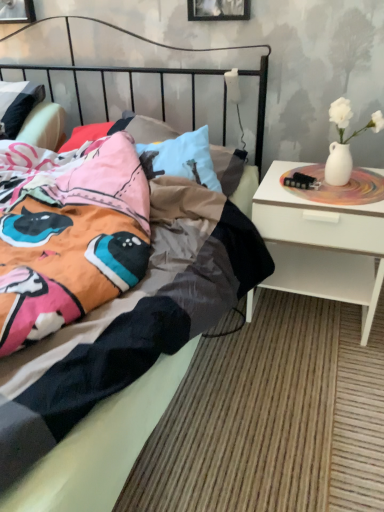
Question: Is metallic silver picture frame at upper left, arranged as the first picture frame when viewed from the left, aimed at black matte picture frame at upper center, the second picture frame from the left?

Choices:
 (A) yes
 (B) no

Answer: (B)

Question: Does metallic silver picture frame at upper left, the 1th picture frame in the back-to-front sequence, appear on the right side of black matte picture frame at upper center, which ranks as the 1th picture frame in front-to-back order?

Choices:
 (A) yes
 (B) no

Answer: (B)

Question: Is there a large distance between metallic silver picture frame at upper left, placed as the second picture frame when sorted from front to back, and black matte picture frame at upper center, arranged as the second picture frame when viewed from the back?

Choices:
 (A) no
 (B) yes

Answer: (A)

Question: From a real-world perspective, does metallic silver picture frame at upper left, placed as the second picture frame when sorted from front to back, sit lower than black matte picture frame at upper center, the second picture frame from the left?

Choices:
 (A) no
 (B) yes

Answer: (B)

Question: Considering the relative sizes of metallic silver picture frame at upper left, arranged as the first picture frame when viewed from the left, and black matte picture frame at upper center, which ranks as the 1th picture frame in front-to-back order, in the image provided, is metallic silver picture frame at upper left, arranged as the first picture frame when viewed from the left, wider than black matte picture frame at upper center, which ranks as the 1th picture frame in front-to-back order,?

Choices:
 (A) yes
 (B) no

Answer: (A)

Question: Is metallic silver picture frame at upper left, arranged as the first picture frame when viewed from the left, to the left of black matte picture frame at upper center, arranged as the second picture frame when viewed from the back, from the viewer's perspective?

Choices:
 (A) yes
 (B) no

Answer: (A)

Question: Considering the relative sizes of white glossy nightstand at right and black matte picture frame at upper center, the second picture frame from the left, in the image provided, is white glossy nightstand at right wider than black matte picture frame at upper center, the second picture frame from the left,?

Choices:
 (A) yes
 (B) no

Answer: (A)

Question: Is white glossy nightstand at right to the left of black matte picture frame at upper center, the second picture frame from the left, from the viewer's perspective?

Choices:
 (A) yes
 (B) no

Answer: (B)

Question: Is white glossy nightstand at right in front of black matte picture frame at upper center, which ranks as the 1th picture frame in front-to-back order?

Choices:
 (A) yes
 (B) no

Answer: (A)

Question: Can you confirm if white glossy nightstand at right is thinner than black matte picture frame at upper center, the second picture frame from the left?

Choices:
 (A) no
 (B) yes

Answer: (A)

Question: From the image's perspective, would you say white glossy nightstand at right is shown under black matte picture frame at upper center, positioned as the first picture frame in right-to-left order?

Choices:
 (A) yes
 (B) no

Answer: (A)

Question: Is white glossy nightstand at right directly adjacent to black matte picture frame at upper center, positioned as the first picture frame in right-to-left order?

Choices:
 (A) yes
 (B) no

Answer: (B)

Question: Does black matte picture frame at upper center, the second picture frame from the left, appear on the right side of metallic silver picture frame at upper left, arranged as the 2th picture frame when viewed from the right?

Choices:
 (A) yes
 (B) no

Answer: (A)